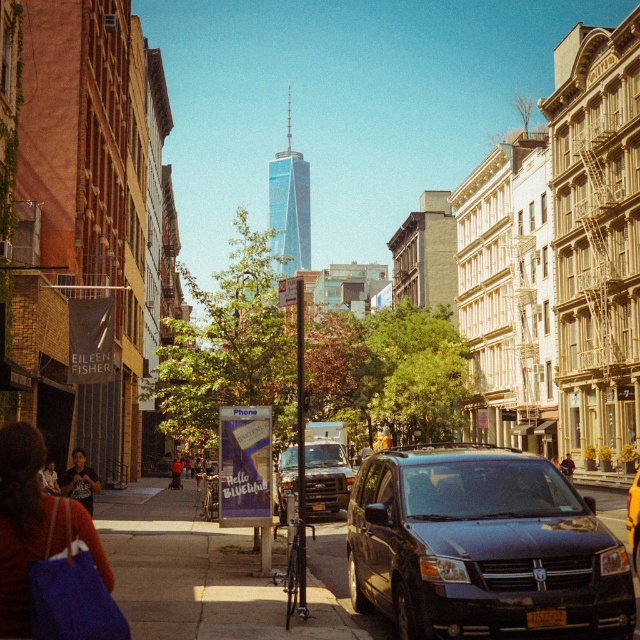
At what (x,y) coordinates should I click in order to perform the action: click on smooth concrete sidewalk at center. Please return your answer as a coordinate pair (x, y). The image size is (640, 640). Looking at the image, I should click on (198, 572).

Between smooth concrete sidewalk at center and dark gray t-shirt at lower left, which one has less height?

With less height is dark gray t-shirt at lower left.

Is point (177, 497) less distant than point (74, 456)?

No, it is behind (74, 456).

Where is `smooth concrete sidewalk at center`? The height and width of the screenshot is (640, 640). smooth concrete sidewalk at center is located at coordinates (198, 572).

Does smooth concrete sidewalk at center have a greater width compared to yellow matte taxi at center?

Correct, the width of smooth concrete sidewalk at center exceeds that of yellow matte taxi at center.

Does smooth concrete sidewalk at center have a smaller size compared to yellow matte taxi at center?

Actually, smooth concrete sidewalk at center might be larger than yellow matte taxi at center.

What do you see at coordinates (198, 572) in the screenshot? The image size is (640, 640). I see `smooth concrete sidewalk at center` at bounding box center [198, 572].

Image resolution: width=640 pixels, height=640 pixels. Find the location of `smooth concrete sidewalk at center`. smooth concrete sidewalk at center is located at coordinates (198, 572).

Does shiny black van at center have a greater width compared to yellow matte taxi at center?

Correct, the width of shiny black van at center exceeds that of yellow matte taxi at center.

Does shiny black van at center appear over yellow matte taxi at center?

Yes, shiny black van at center is above yellow matte taxi at center.

Is point (468, 572) positioned after point (634, 566)?

No, (468, 572) is in front of (634, 566).

At what (x,y) coordinates should I click in order to perform the action: click on shiny black van at center. Please return your answer as a coordinate pair (x, y). This screenshot has height=640, width=640. Looking at the image, I should click on (481, 547).